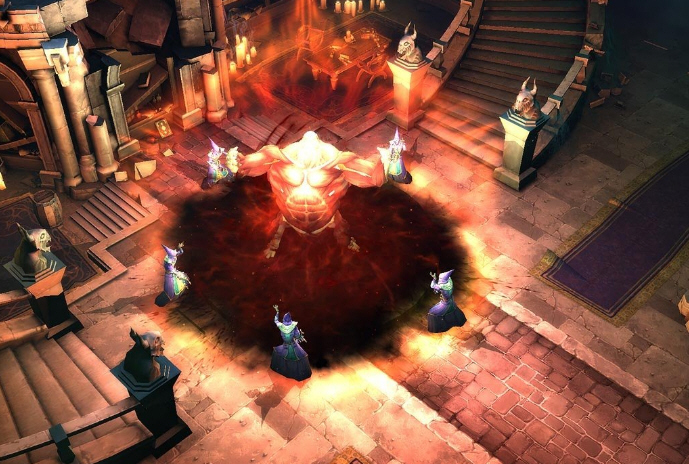
Locate an element on the screen. statue is located at coordinates (304, 167).